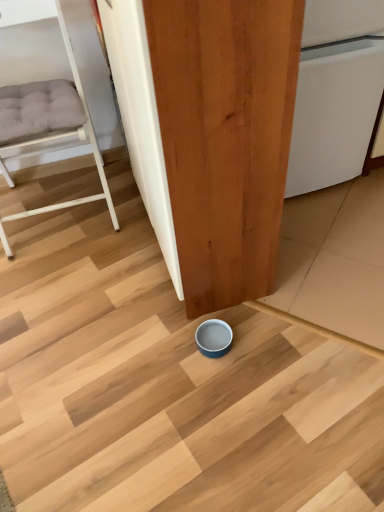
Question: Considering the positions of point (77, 81) and point (297, 117), is point (77, 81) closer or farther from the camera than point (297, 117)?

Choices:
 (A) closer
 (B) farther

Answer: (B)

Question: Is white matte bunk bed at left spatially inside white glossy dishwasher at center, or outside of it?

Choices:
 (A) inside
 (B) outside

Answer: (B)

Question: Considering the real-world distances, which object is farthest from the matte wood door at center?

Choices:
 (A) white glossy dishwasher at center
 (B) white matte bunk bed at left

Answer: (B)

Question: Which object is the closest to the white matte bunk bed at left?

Choices:
 (A) white glossy dishwasher at center
 (B) matte wood door at center

Answer: (B)